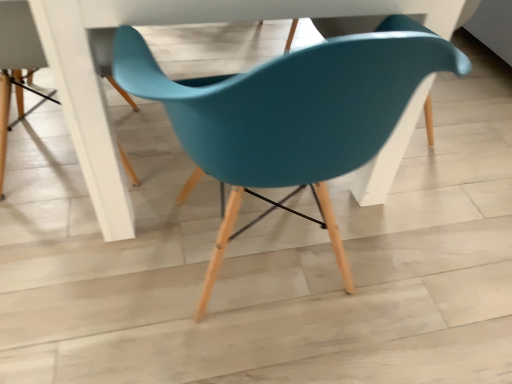
At what (x,y) coordinates should I click in order to perform the action: click on blank space to the left of teal plastic chair at center, which is the 2th chair in left-to-right order. Please return your answer as a coordinate pair (x, y). Image resolution: width=512 pixels, height=384 pixels. Looking at the image, I should click on (83, 290).